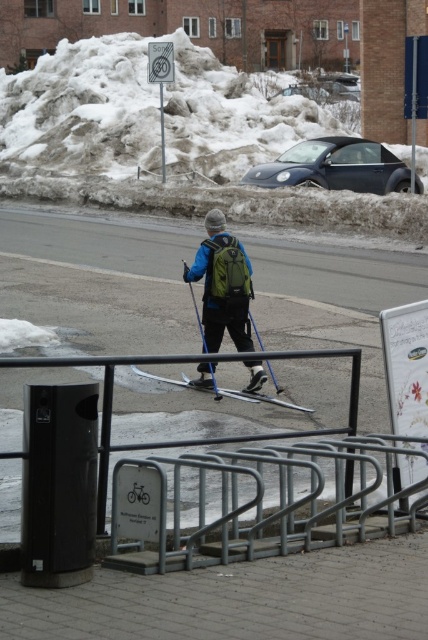
Question: Does blue plastic ski pole at center lie in front of brushed metal pole at upper center?

Choices:
 (A) no
 (B) yes

Answer: (B)

Question: Is green matte backpack at center to the right of silver metallic skis at center from the viewer's perspective?

Choices:
 (A) no
 (B) yes

Answer: (B)

Question: Which object is closer to the camera taking this photo?

Choices:
 (A) gray metallic bike rack at lower center
 (B) silver metallic skis at center
 (C) green matte backpack at center

Answer: (A)

Question: Which object is closer to the camera taking this photo?

Choices:
 (A) green matte backpack at center
 (B) silver metallic skis at center
 (C) matte blue jacket at center
 (D) gray metallic bike rack at lower center

Answer: (D)

Question: Estimate the real-world distances between objects in this image. Which object is closer to the gray concrete pavement at center?

Choices:
 (A) matte blue ski pole at center
 (B) silver metallic skis at center

Answer: (B)

Question: Can you confirm if matte blue jacket at center is positioned above matte blue ski pole at center?

Choices:
 (A) no
 (B) yes

Answer: (B)